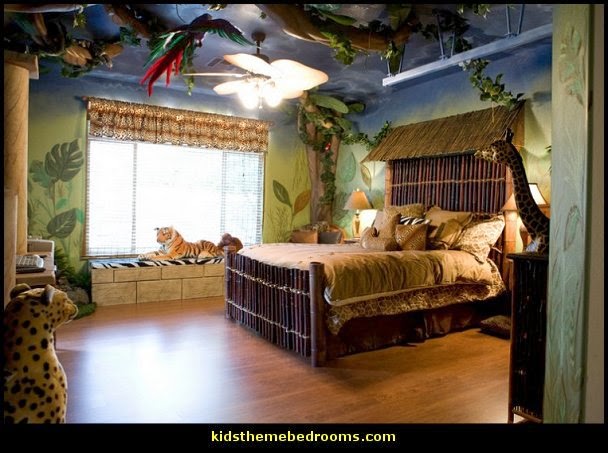
The height and width of the screenshot is (453, 608). In order to click on wall in this screenshot , I will do `click(173, 282)`, `click(50, 128)`, `click(423, 97)`.